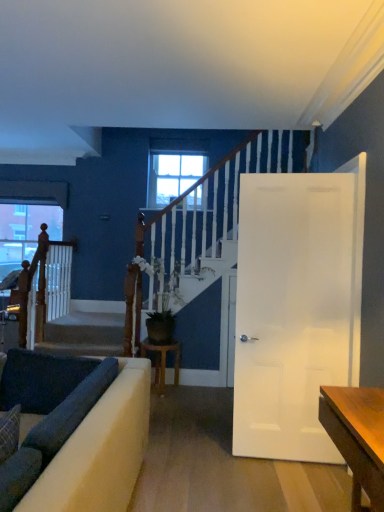
This screenshot has height=512, width=384. Identify the location of vacant space in front of white glossy door at right. (289, 486).